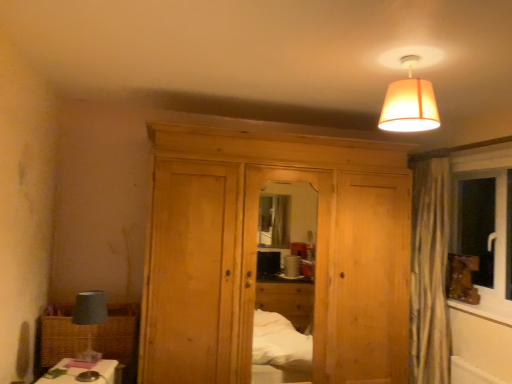
Question: Looking at their shapes, would you say wooden frame at right is wider or thinner than natural wood dresser at center?

Choices:
 (A) thin
 (B) wide

Answer: (A)

Question: Considering the positions of wooden frame at right and natural wood dresser at center in the image, is wooden frame at right taller or shorter than natural wood dresser at center?

Choices:
 (A) tall
 (B) short

Answer: (B)

Question: Which is nearer to the orange fabric lampshade at upper center?

Choices:
 (A) wooden frame at right
 (B) matte gray lampshade at left
 (C) natural wood dresser at center
 (D) woven brown picnic basket at lower left

Answer: (C)

Question: Considering the real-world distances, which object is farthest from the orange fabric lampshade at upper center?

Choices:
 (A) wooden frame at right
 (B) matte gray lampshade at left
 (C) natural wood dresser at center
 (D) woven brown picnic basket at lower left

Answer: (D)